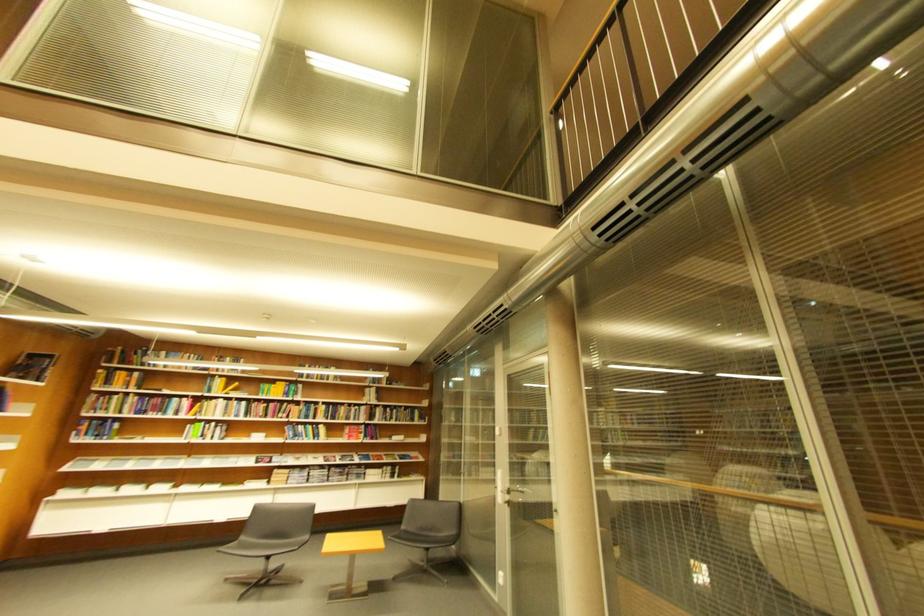
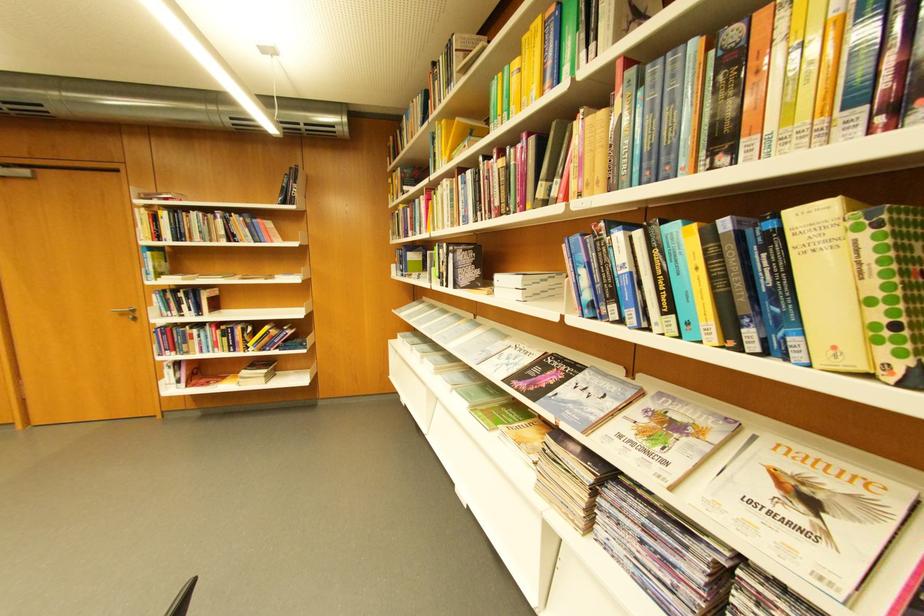
Where in the second image is the point corresponding to pixel 268 464 from the first image?

(532, 377)